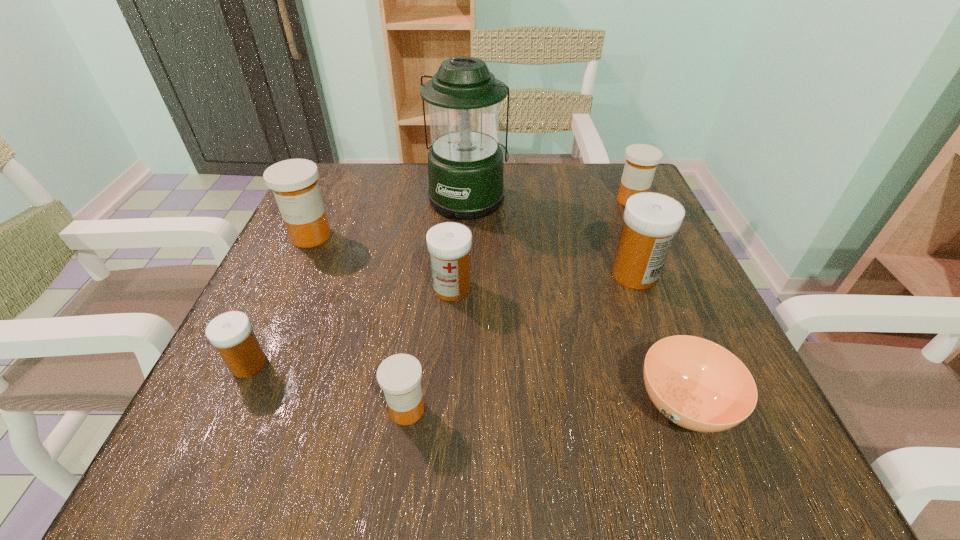
At what (x,y) coordinates should I click in order to perform the action: click on the tallest object. Please return your answer as a coordinate pair (x, y). This screenshot has height=540, width=960. Looking at the image, I should click on (465, 163).

Identify the location of lantern. This screenshot has width=960, height=540. (465, 163).

Locate an element on the screen. Image resolution: width=960 pixels, height=540 pixels. the sixth nearest object is located at coordinates pyautogui.click(x=294, y=183).

Locate an element on the screen. the biggest orange medicine is located at coordinates (294, 183).

Find the location of a particular element. the rightmost white medicine is located at coordinates (651, 220).

Locate an element on the screen. The width and height of the screenshot is (960, 540). the farthest medicine is located at coordinates (641, 162).

The width and height of the screenshot is (960, 540). In order to click on the second biggest orange medicine in this screenshot , I will do `click(641, 162)`.

Identify the location of the second white medicine from right to left. The image size is (960, 540). (449, 243).

This screenshot has width=960, height=540. I want to click on the smallest white medicine, so click(231, 333).

Find the location of a particular element. the leftmost white medicine is located at coordinates (231, 333).